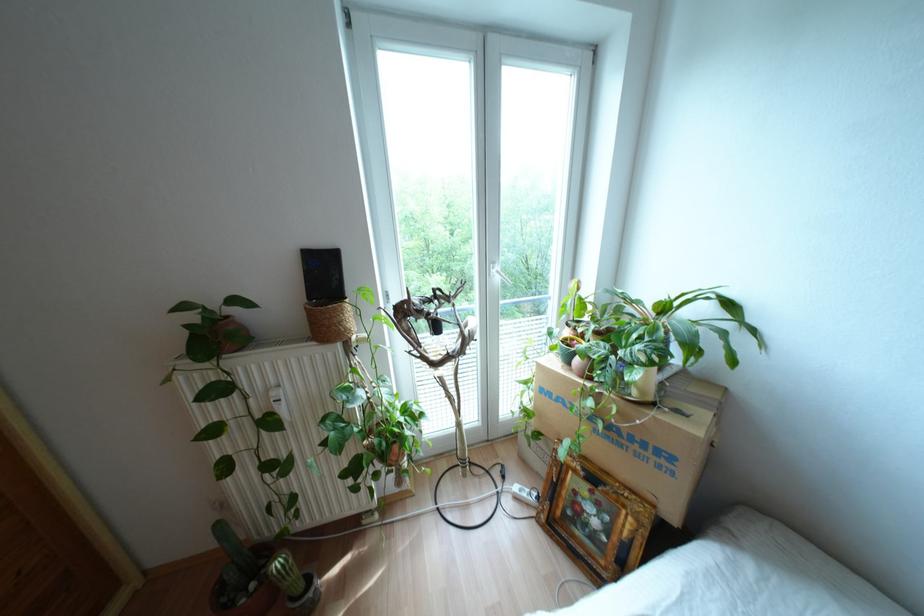
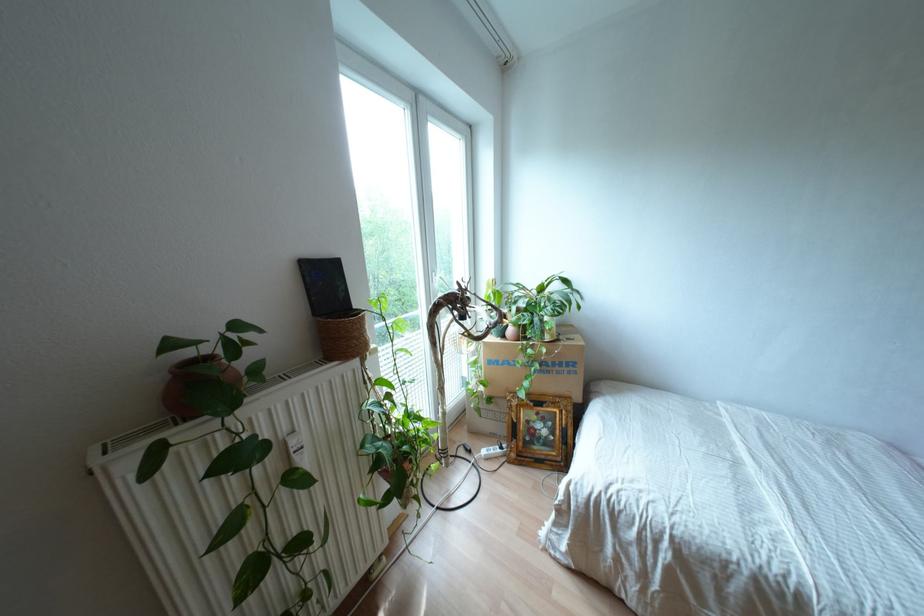
Find the pixel in the second image that matches pixel 642 445 in the first image.

(560, 363)